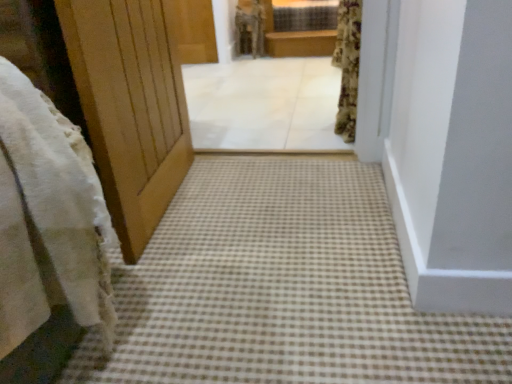
Question: Does white fluffy robe at upper center have a lesser width compared to brown wooden balustrade at upper center?

Choices:
 (A) yes
 (B) no

Answer: (B)

Question: Considering the relative sizes of white fluffy robe at upper center and brown wooden balustrade at upper center in the image provided, is white fluffy robe at upper center taller than brown wooden balustrade at upper center?

Choices:
 (A) yes
 (B) no

Answer: (A)

Question: Can you confirm if white fluffy robe at upper center is smaller than brown wooden balustrade at upper center?

Choices:
 (A) yes
 (B) no

Answer: (A)

Question: Can you confirm if white fluffy robe at upper center is shorter than brown wooden balustrade at upper center?

Choices:
 (A) no
 (B) yes

Answer: (A)

Question: Does white fluffy robe at upper center appear on the left side of brown wooden balustrade at upper center?

Choices:
 (A) no
 (B) yes

Answer: (B)

Question: From the image's perspective, is white fluffy robe at upper center under brown wooden balustrade at upper center?

Choices:
 (A) no
 (B) yes

Answer: (A)

Question: Does white fluffy robe at upper center appear on the right side of fluffy floral curtain at upper right?

Choices:
 (A) yes
 (B) no

Answer: (B)

Question: Is white fluffy robe at upper center positioned before fluffy floral curtain at upper right?

Choices:
 (A) yes
 (B) no

Answer: (B)

Question: Is white fluffy robe at upper center positioned with its back to fluffy floral curtain at upper right?

Choices:
 (A) yes
 (B) no

Answer: (B)

Question: From the image's perspective, is white fluffy robe at upper center on fluffy floral curtain at upper right?

Choices:
 (A) yes
 (B) no

Answer: (A)

Question: From a real-world perspective, is white fluffy robe at upper center located higher than fluffy floral curtain at upper right?

Choices:
 (A) no
 (B) yes

Answer: (A)

Question: Does white fluffy robe at upper center have a lesser height compared to fluffy floral curtain at upper right?

Choices:
 (A) yes
 (B) no

Answer: (A)

Question: Considering the relative positions of brown checkered carpet at center and white tile floor at center in the image provided, is brown checkered carpet at center to the right of white tile floor at center from the viewer's perspective?

Choices:
 (A) yes
 (B) no

Answer: (A)